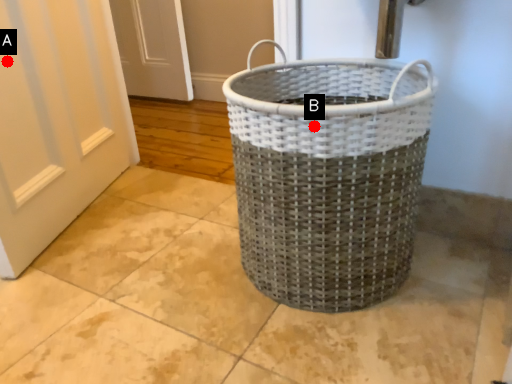
Question: Two points are circled on the image, labeled by A and B beside each circle. Which point is further to the camera?

Choices:
 (A) A is further
 (B) B is further

Answer: (A)